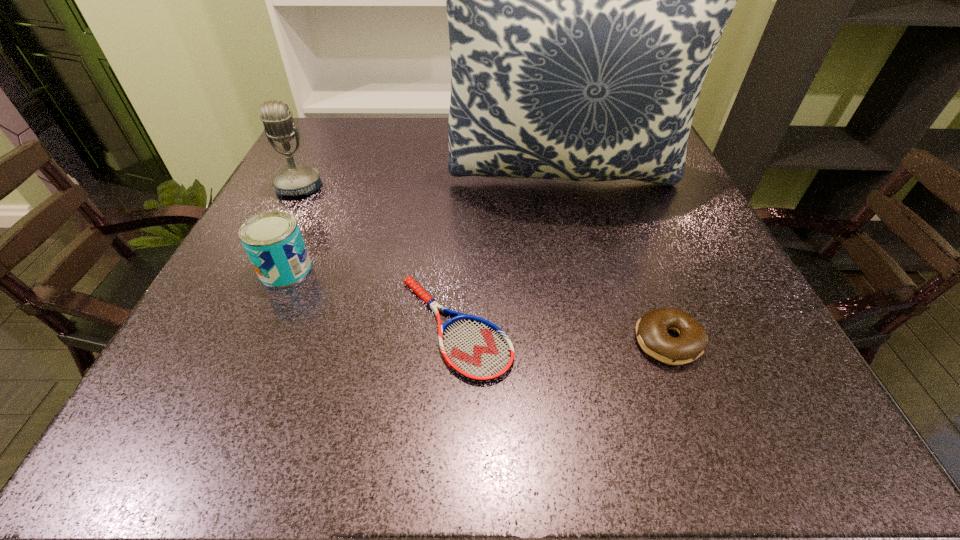
Locate an element on the screen. Image resolution: width=960 pixels, height=540 pixels. vacant area at the far left corner is located at coordinates (362, 139).

Locate an element on the screen. Image resolution: width=960 pixels, height=540 pixels. vacant space that is in between the doughnut and the microphone is located at coordinates (484, 264).

This screenshot has height=540, width=960. Find the location of `vacant space that's between the can and the tallest object`. vacant space that's between the can and the tallest object is located at coordinates (425, 225).

Identify the location of vacant area that lies between the microphone and the tallest object. (432, 184).

Identify the location of free area in between the third tallest object and the doughnut. This screenshot has height=540, width=960. (476, 305).

You are a GUI agent. You are given a task and a screenshot of the screen. Output one action in this format:
    pyautogui.click(x=<x>, y=<y>)
    Task: Click on the free point between the fourth tallest object and the tennis racket
    Image resolution: width=960 pixels, height=540 pixels.
    Given the screenshot: What is the action you would take?
    pyautogui.click(x=562, y=334)

At what (x,y) coordinates should I click in order to perform the action: click on free space between the tallest object and the microphone. Please return your answer as a coordinate pair (x, y). The image size is (960, 540). Looking at the image, I should click on (432, 184).

Where is `vacant area that lies between the cushion and the third shortest object`? The width and height of the screenshot is (960, 540). vacant area that lies between the cushion and the third shortest object is located at coordinates (425, 225).

This screenshot has height=540, width=960. I want to click on unoccupied position between the third shortest object and the tallest object, so click(x=425, y=225).

Where is `the fourth closest object to the second shortest object`? The height and width of the screenshot is (540, 960). the fourth closest object to the second shortest object is located at coordinates (294, 180).